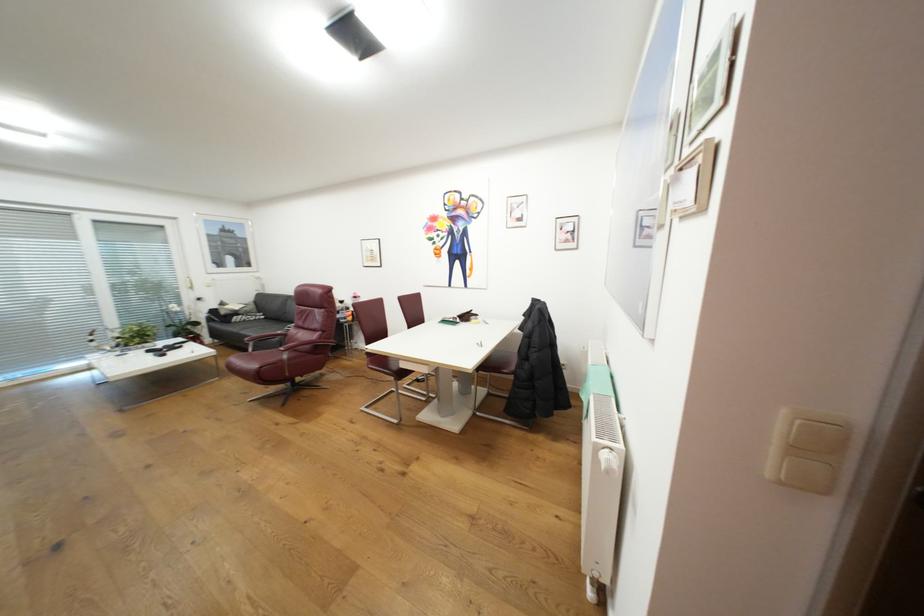
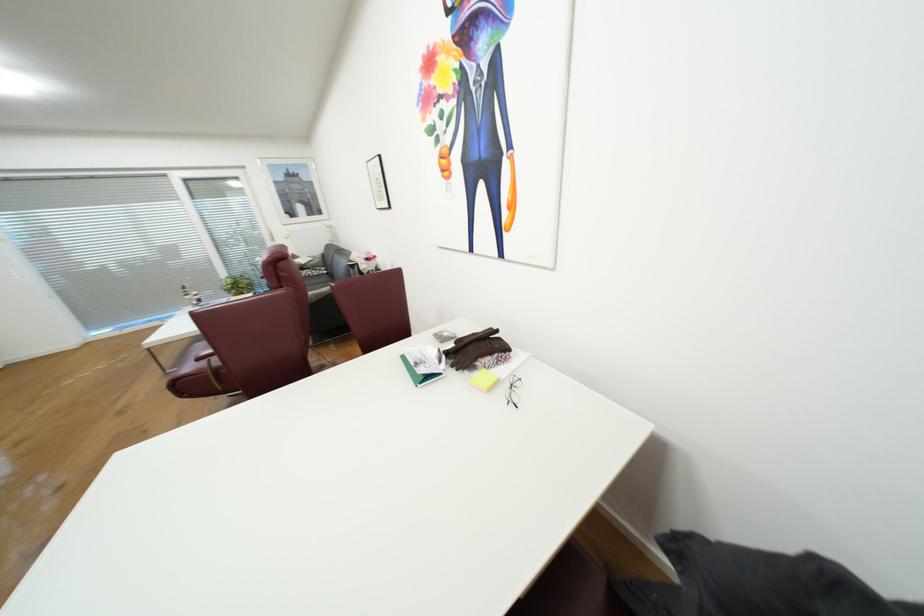
Where in the second image is the point corresponding to the point at 472,315 from the first image?

(481, 350)